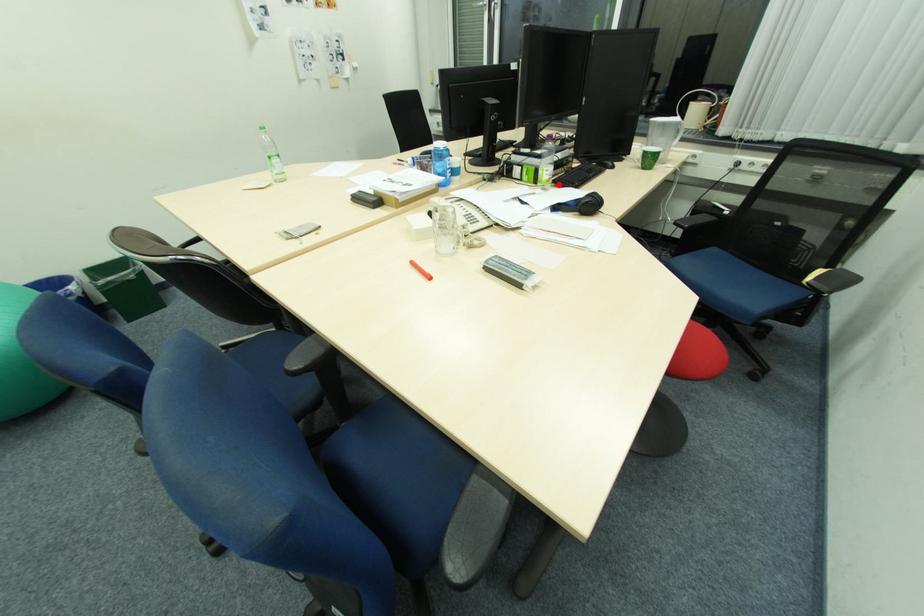
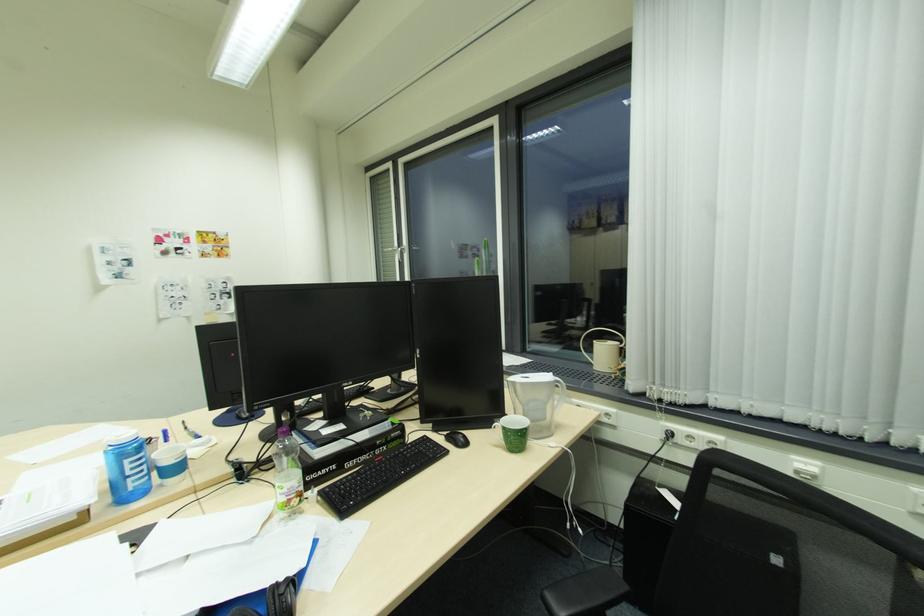
The point at the highlighted location is marked in the first image. Where is the corresponding point in the second image?

(324, 499)